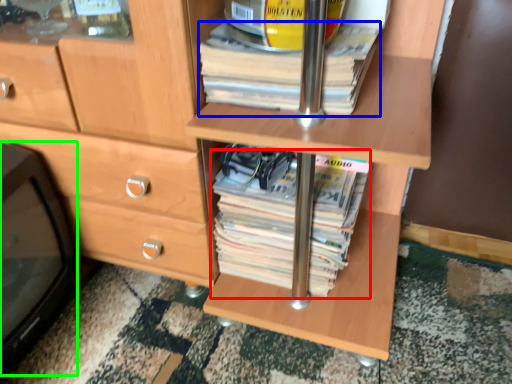
Question: Based on their relative distances, which object is nearer to paperback book (highlighted by a red box)? Choose from paperback book (highlighted by a blue box) and desktop (highlighted by a green box).

Choices:
 (A) paperback book
 (B) desktop

Answer: (A)